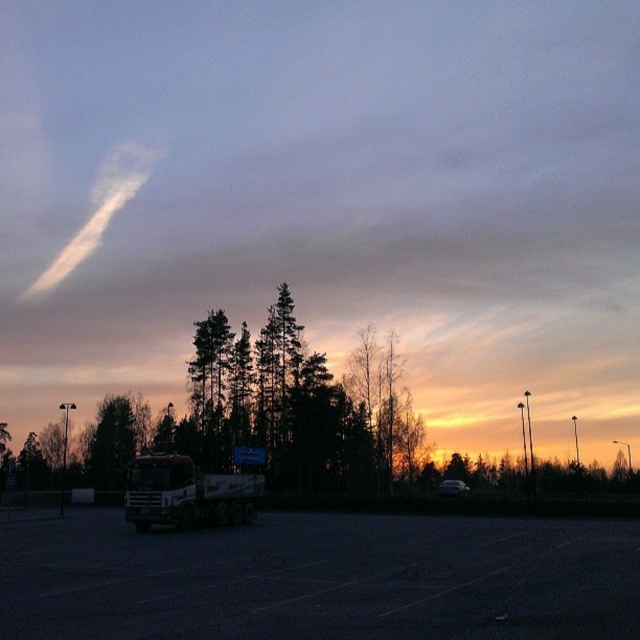
Question: Which of the following is the closest to the observer?

Choices:
 (A) (454, 480)
 (B) (173, 468)
 (C) (132, 547)

Answer: (C)

Question: Is white matte truck at center smaller than matte white truck at lower center?

Choices:
 (A) no
 (B) yes

Answer: (B)

Question: Considering the real-world distances, which object is farthest from the white matte truck at center?

Choices:
 (A) matte white truck at lower center
 (B) black asphalt parking lot at center

Answer: (A)

Question: Does black asphalt parking lot at center appear on the left side of white matte truck at center?

Choices:
 (A) yes
 (B) no

Answer: (B)

Question: Estimate the real-world distances between objects in this image. Which object is farther from the matte white truck at lower center?

Choices:
 (A) white matte truck at center
 (B) black asphalt parking lot at center

Answer: (B)

Question: Can you confirm if black asphalt parking lot at center is positioned above matte white truck at lower center?

Choices:
 (A) no
 (B) yes

Answer: (B)